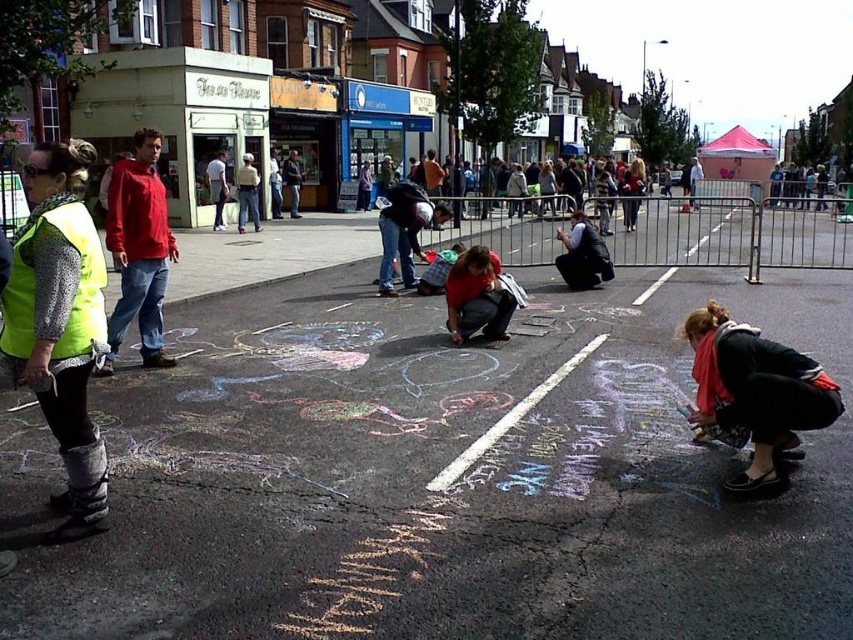
Between black fabric scarf at lower right and matte red shirt at center, which one appears on the right side from the viewer's perspective?

From the viewer's perspective, matte red shirt at center appears more on the right side.

Does black fabric scarf at lower right have a larger size compared to matte red shirt at center?

Actually, black fabric scarf at lower right might be smaller than matte red shirt at center.

Which is in front, point (705, 392) or point (636, 176)?

Point (705, 392) is more forward.

The image size is (853, 640). I want to click on black fabric scarf at lower right, so click(755, 394).

Between chalk drawing at center and black fabric scarf at lower right, which one has more height?

chalk drawing at center

Locate an element on the screen. This screenshot has width=853, height=640. chalk drawing at center is located at coordinates (437, 476).

Who is more forward, (54, 378) or (625, 180)?

Point (54, 378) is in front.

This screenshot has height=640, width=853. What do you see at coordinates (61, 324) in the screenshot? I see `neon yellow reflective vest at left` at bounding box center [61, 324].

Where is `neon yellow reflective vest at left`? Image resolution: width=853 pixels, height=640 pixels. neon yellow reflective vest at left is located at coordinates (61, 324).